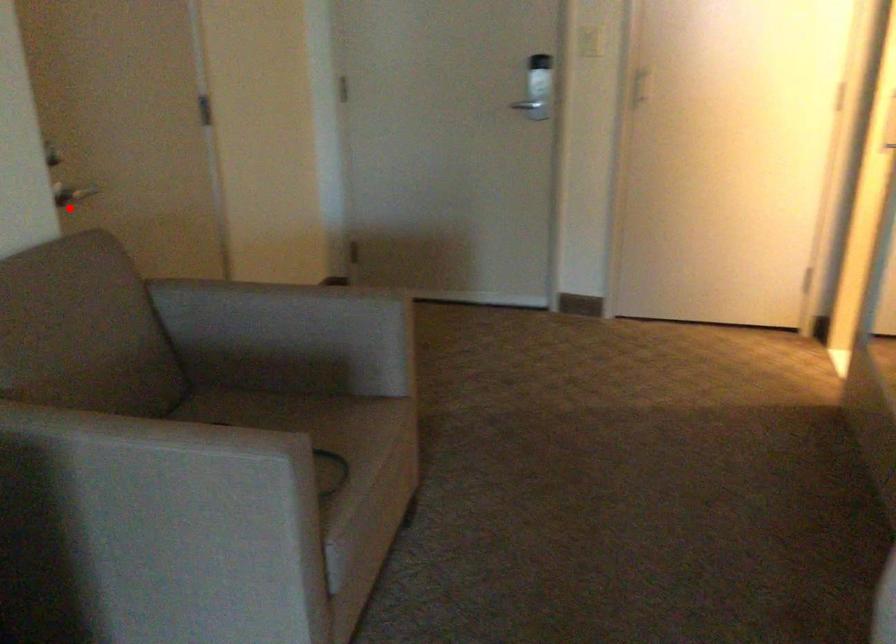
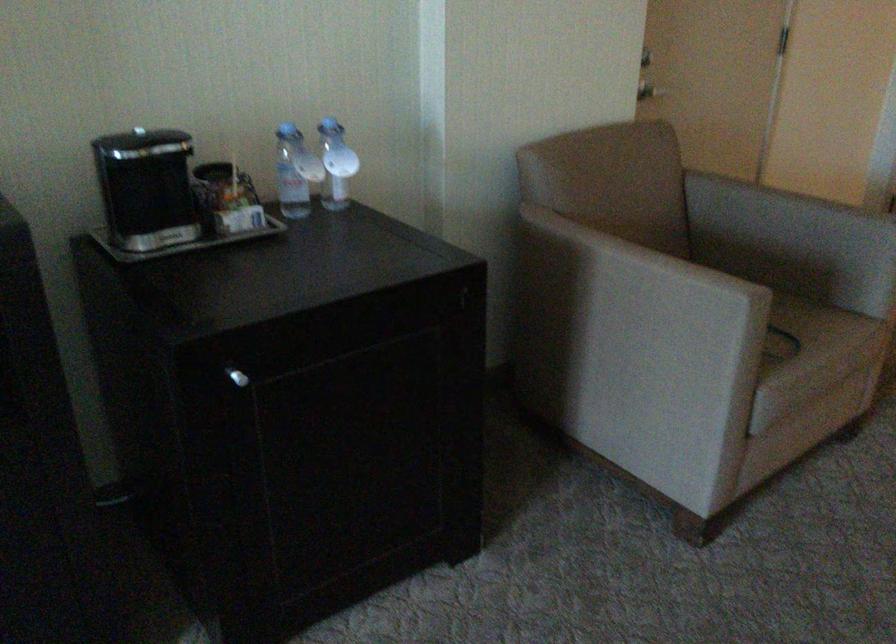
Question: I am providing you with two images of the same scene from different viewpoints. A red point is shown in image1. For the corresponding object point in image2, is it positioned nearer or farther from the camera?

Choices:
 (A) Nearer
 (B) Farther

Answer: (B)